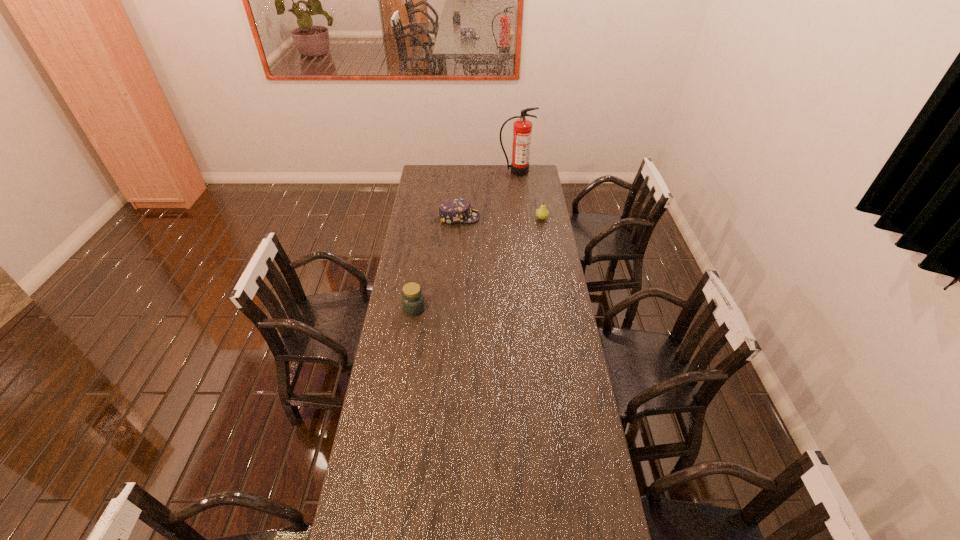
Where is `unoccupied area between the headwear and the pear`? This screenshot has width=960, height=540. unoccupied area between the headwear and the pear is located at coordinates (500, 218).

I want to click on unoccupied area between the pear and the jar, so click(x=478, y=264).

The height and width of the screenshot is (540, 960). I want to click on free point between the jar and the farthest object, so click(465, 240).

Identify the location of free spot between the pear and the tallest object. Image resolution: width=960 pixels, height=540 pixels. (529, 195).

Where is `free space between the headwear and the third shortest object`? free space between the headwear and the third shortest object is located at coordinates (437, 263).

I want to click on free point between the jar and the pear, so click(x=478, y=264).

At what (x,y) coordinates should I click in order to perform the action: click on unoccupied position between the pear and the third object from right to left. Please return your answer as a coordinate pair (x, y). The height and width of the screenshot is (540, 960). Looking at the image, I should click on (500, 218).

The image size is (960, 540). Identify the location of free spot between the leftmost object and the third object from right to left. (437, 263).

This screenshot has width=960, height=540. What are the coordinates of `unoccupied position between the pear and the headwear` in the screenshot? It's located at (500, 218).

Find the location of `object that is the third closest to the tallest object`. object that is the third closest to the tallest object is located at coordinates (413, 303).